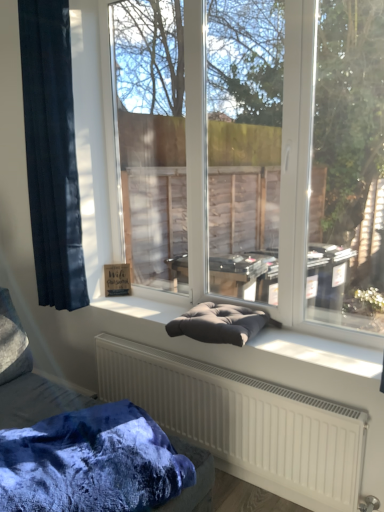
Question: Is the depth of velvet cushion at center greater than that of dark gray cushion at center?

Choices:
 (A) yes
 (B) no

Answer: (B)

Question: Is velvet cushion at center far from dark gray cushion at center?

Choices:
 (A) yes
 (B) no

Answer: (B)

Question: Is velvet cushion at center shorter than dark gray cushion at center?

Choices:
 (A) no
 (B) yes

Answer: (A)

Question: Is velvet cushion at center looking in the opposite direction of dark gray cushion at center?

Choices:
 (A) no
 (B) yes

Answer: (A)

Question: Is velvet cushion at center to the left of dark gray cushion at center from the viewer's perspective?

Choices:
 (A) yes
 (B) no

Answer: (A)

Question: Is velvet cushion at center located outside dark gray cushion at center?

Choices:
 (A) yes
 (B) no

Answer: (A)

Question: Is dark gray cushion at center positioned in front of velvety blue blanket at lower left?

Choices:
 (A) no
 (B) yes

Answer: (A)

Question: Does dark gray cushion at center have a smaller size compared to velvety blue blanket at lower left?

Choices:
 (A) yes
 (B) no

Answer: (A)

Question: Is dark gray cushion at center behind velvety blue blanket at lower left?

Choices:
 (A) no
 (B) yes

Answer: (B)

Question: From a real-world perspective, does dark gray cushion at center sit lower than velvety blue blanket at lower left?

Choices:
 (A) no
 (B) yes

Answer: (A)

Question: Would you say dark gray cushion at center contains velvety blue blanket at lower left?

Choices:
 (A) yes
 (B) no

Answer: (B)

Question: Is dark gray cushion at center to the left of velvety blue blanket at lower left from the viewer's perspective?

Choices:
 (A) yes
 (B) no

Answer: (B)

Question: Can you confirm if dark blue fabric at left is bigger than dark gray fabric cushion at center?

Choices:
 (A) no
 (B) yes

Answer: (B)